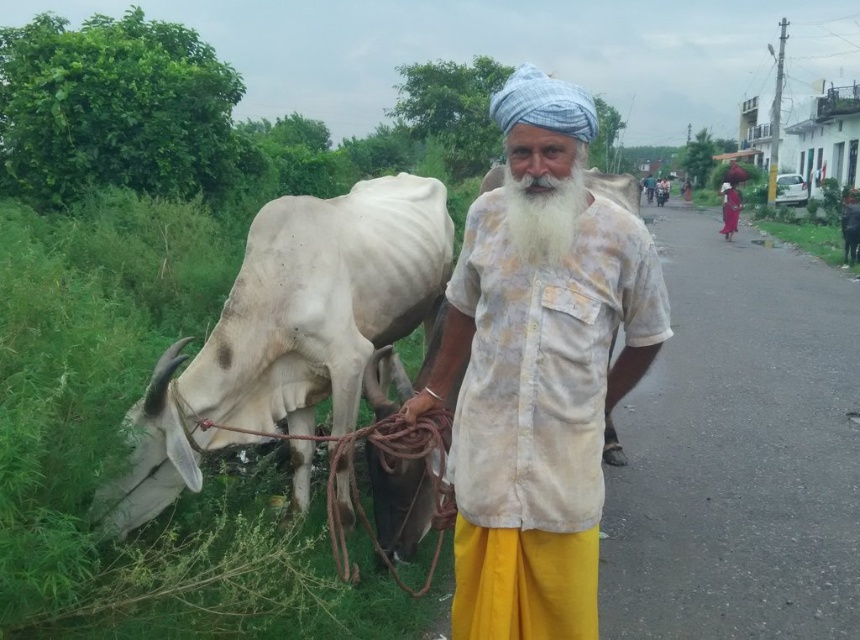
You are a photographer trying to capture both the white cotton shirt at center and the white matte cow at left in a single frame. Given their sizes in the image, which object would require you to adjust your camera to focus on a closer subject to ensure both are in focus?

The white cotton shirt at center requires focusing on a closer subject because it occupies less space in the image compared to the white matte cow at left, indicating it is smaller and farther away.